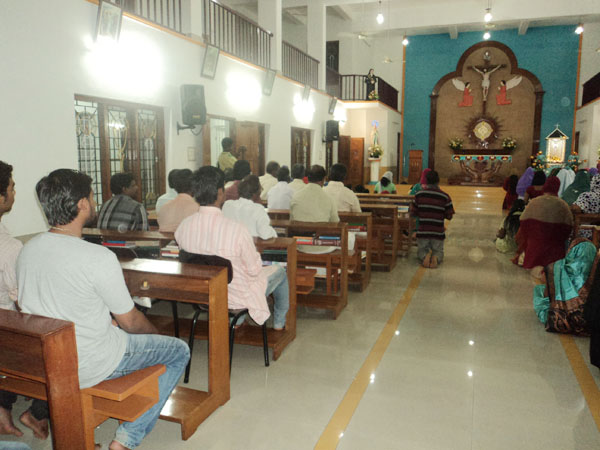
The width and height of the screenshot is (600, 450). In order to click on blue wall in this screenshot , I will do `click(416, 71)`.